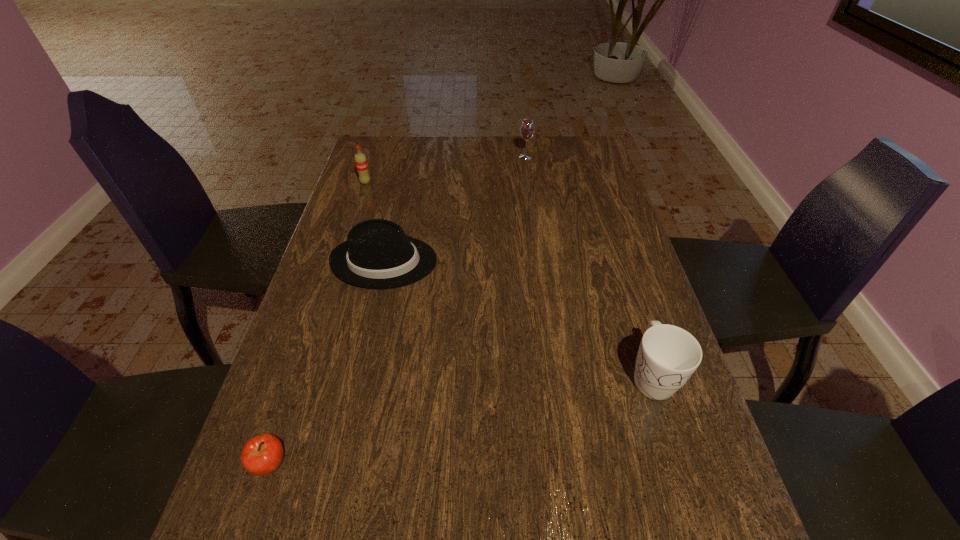
The image size is (960, 540). What are the coordinates of `the farthest object` in the screenshot? It's located at (527, 129).

In order to click on the second object from right to left in this screenshot , I will do `click(527, 129)`.

At what (x,y) coordinates should I click in order to perform the action: click on soda. Please return your answer as a coordinate pair (x, y). Looking at the image, I should click on (361, 163).

Locate an element on the screen. This screenshot has width=960, height=540. the rightmost object is located at coordinates (668, 355).

This screenshot has width=960, height=540. Find the location of `mug`. mug is located at coordinates (668, 355).

The width and height of the screenshot is (960, 540). What are the coordinates of `the third farthest object` in the screenshot? It's located at point(377,254).

Identify the location of the second shortest object. The image size is (960, 540). (377, 254).

You are a GUI agent. You are given a task and a screenshot of the screen. Output one action in this format:
    pyautogui.click(x=<x>, y=<y>)
    Task: Click on the apple
    The image size is (960, 540).
    Given the screenshot: What is the action you would take?
    pyautogui.click(x=262, y=455)

Locate an element on the screen. the shortest object is located at coordinates [262, 455].

What are the coordinates of `vacant space located 0.080m on the back of the farthest object` in the screenshot? It's located at (523, 143).